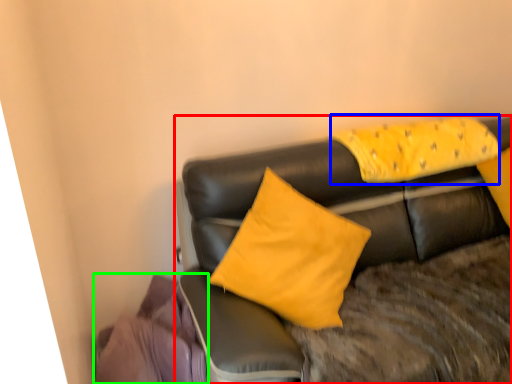
Question: Estimate the real-world distances between objects in this image. Which object is closer to studio couch (highlighted by a red box), pillow (highlighted by a blue box) or material (highlighted by a green box)?

Choices:
 (A) pillow
 (B) material

Answer: (A)